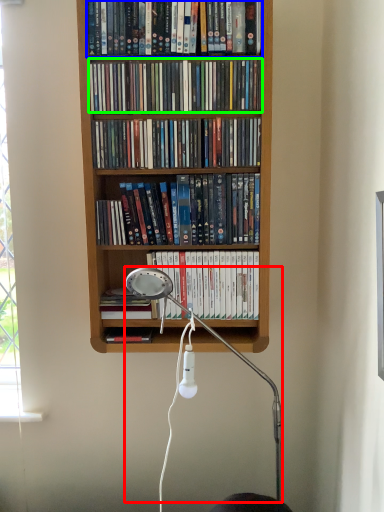
Question: Estimate the real-world distances between objects in this image. Which object is closer to lamp (highlighted by a red box), book (highlighted by a blue box) or book (highlighted by a green box)?

Choices:
 (A) book
 (B) book

Answer: (B)